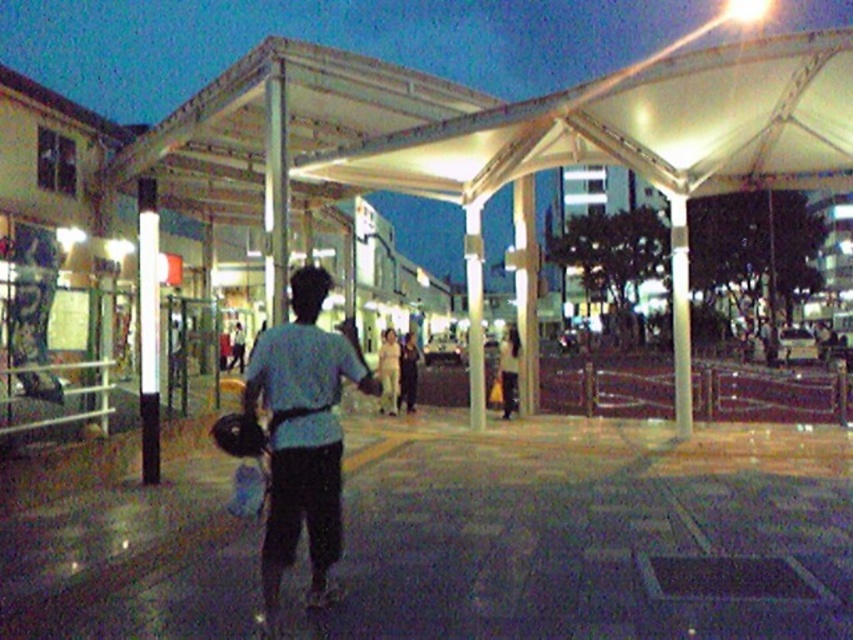
You are a photographer standing at the end of the walkway. You want to capture a photo of the light blue shirt at center without the white translucent canopy at upper center casting a shadow on it. Is this possible given their current positions?

The white translucent canopy at upper center is positioned over the light blue shirt at center, so it will cast a shadow on the shirt. To avoid the shadow, the photographer would need to adjust the angle or position to ensure the canopy is not directly overhead or blocking the light onto the shirt.

You are a photographer trying to capture the person in the image. Since the light beige fabric pants at center and the light blue shirt at center are both in focus, which one would appear larger in your photo?

The light beige fabric pants at center would appear larger in the photo because it is closer to the viewer than the light blue shirt at center.